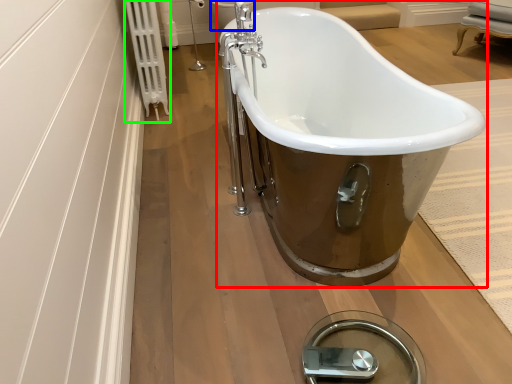
Question: Based on their relative distances, which object is farther from bathtub (highlighted by a red box)? Choose from toilet bowl (highlighted by a blue box) and radiator (highlighted by a green box).

Choices:
 (A) toilet bowl
 (B) radiator

Answer: (A)